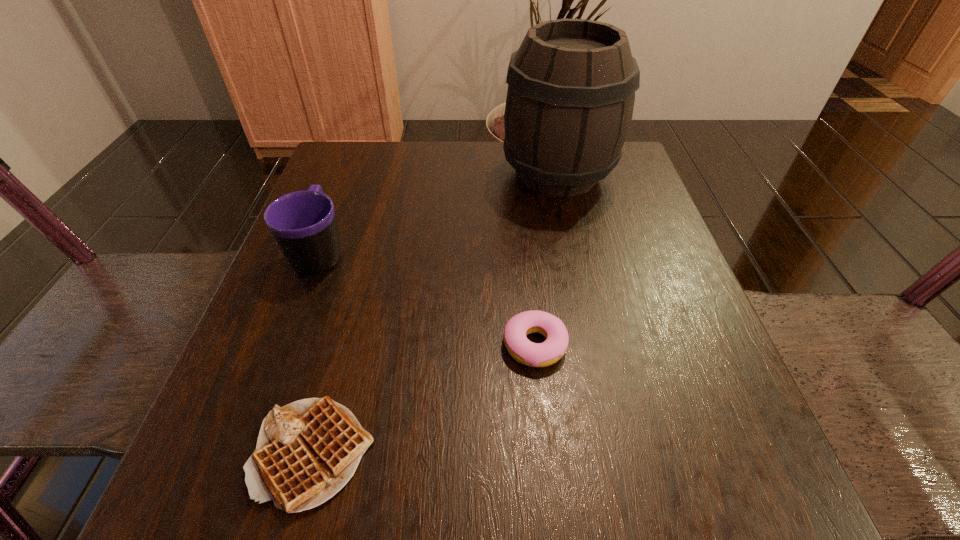
The height and width of the screenshot is (540, 960). Identify the location of vacant area at the near edge of the desktop. (420, 511).

The height and width of the screenshot is (540, 960). Find the location of `vacant area at the left edge`. vacant area at the left edge is located at coordinates (372, 244).

Locate an element on the screen. The height and width of the screenshot is (540, 960). vacant space at the right edge of the desktop is located at coordinates (602, 212).

This screenshot has width=960, height=540. In the image, there is a desktop. Identify the location of vacant space at the far left corner. (397, 143).

In the image, there is a desktop. At what (x,y) coordinates should I click in order to perform the action: click on vacant area at the near left corner. Please return your answer as a coordinate pair (x, y). The height and width of the screenshot is (540, 960). Looking at the image, I should click on (186, 505).

In order to click on vacant space at the far right corner of the desktop in this screenshot , I will do `click(631, 184)`.

Where is `blank region between the tallest object and the third nearest object`? blank region between the tallest object and the third nearest object is located at coordinates (439, 213).

At what (x,y) coordinates should I click in order to perform the action: click on blank region between the mug and the wine bucket. Please return your answer as a coordinate pair (x, y). Looking at the image, I should click on (439, 213).

You are a GUI agent. You are given a task and a screenshot of the screen. Output one action in this format:
    pyautogui.click(x=<x>, y=<y>)
    Task: Click on the vacant point located between the second nearest object and the farthest object
    This screenshot has height=540, width=960.
    Given the screenshot: What is the action you would take?
    pyautogui.click(x=546, y=260)

The width and height of the screenshot is (960, 540). Find the location of `free spot between the nearest object and the second tallest object`. free spot between the nearest object and the second tallest object is located at coordinates (317, 353).